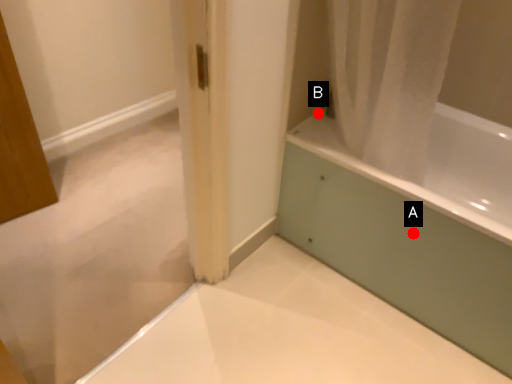
Question: Two points are circled on the image, labeled by A and B beside each circle. Which point is further to the camera?

Choices:
 (A) A is further
 (B) B is further

Answer: (B)